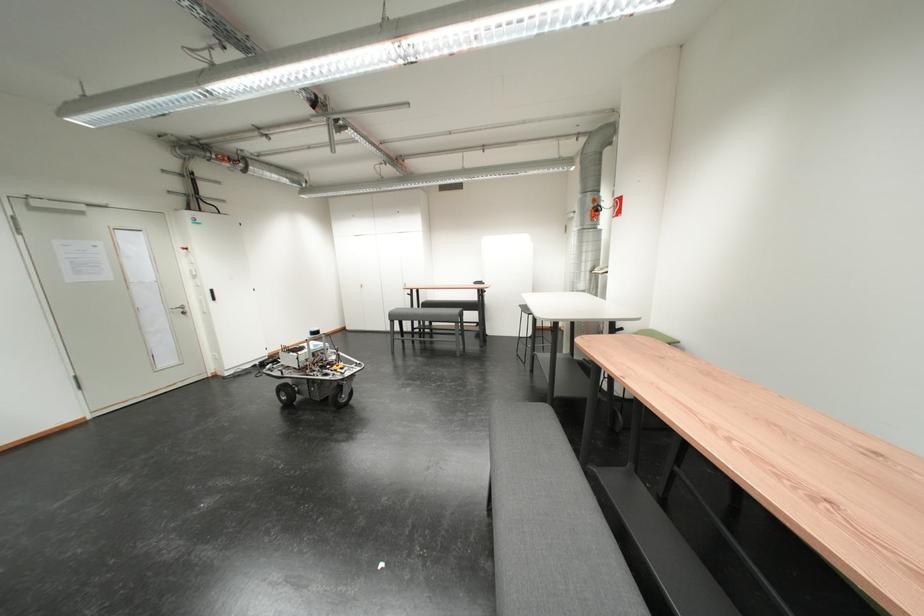
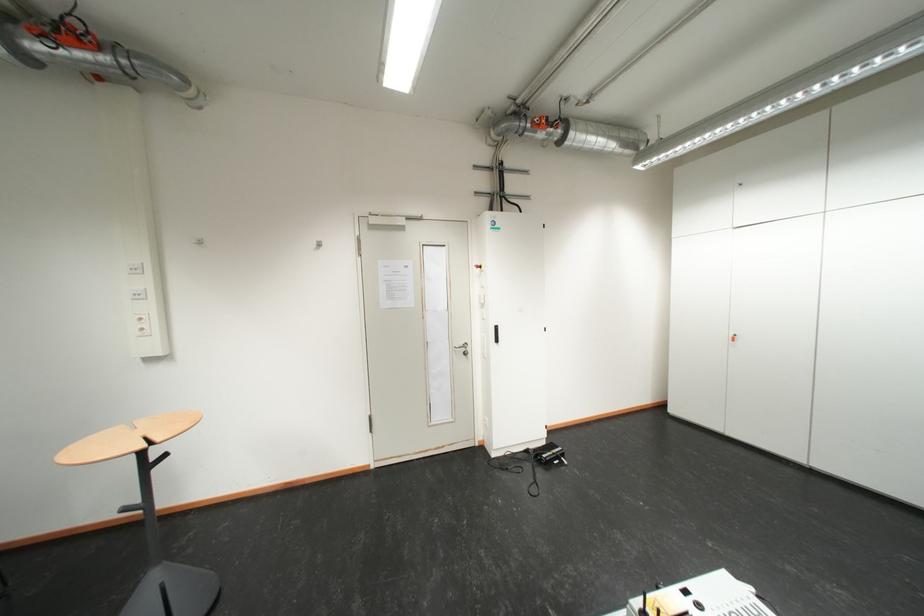
In the second image, find the point that corresponds to the point at 184,314 in the first image.

(466, 353)